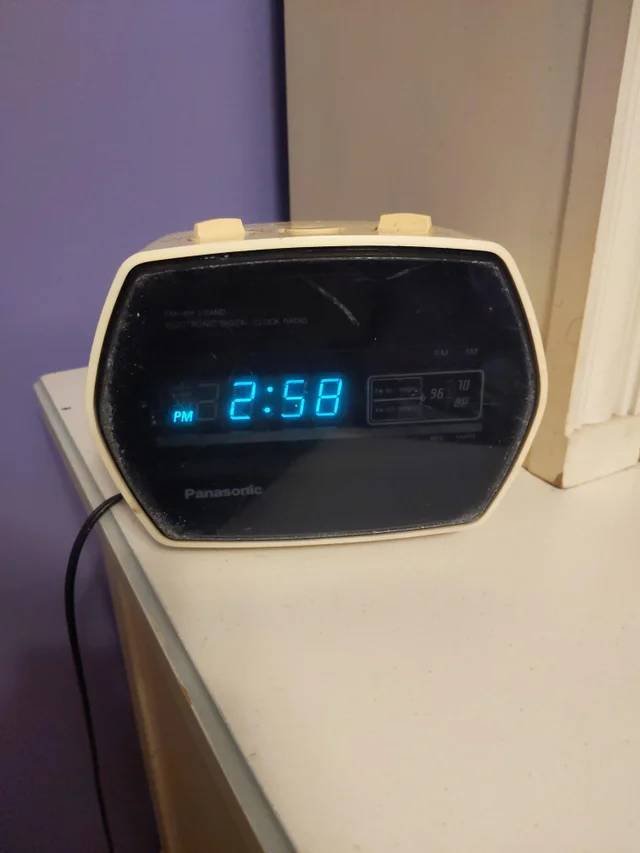
Where is `cord`? This screenshot has width=640, height=853. cord is located at coordinates (76, 544).